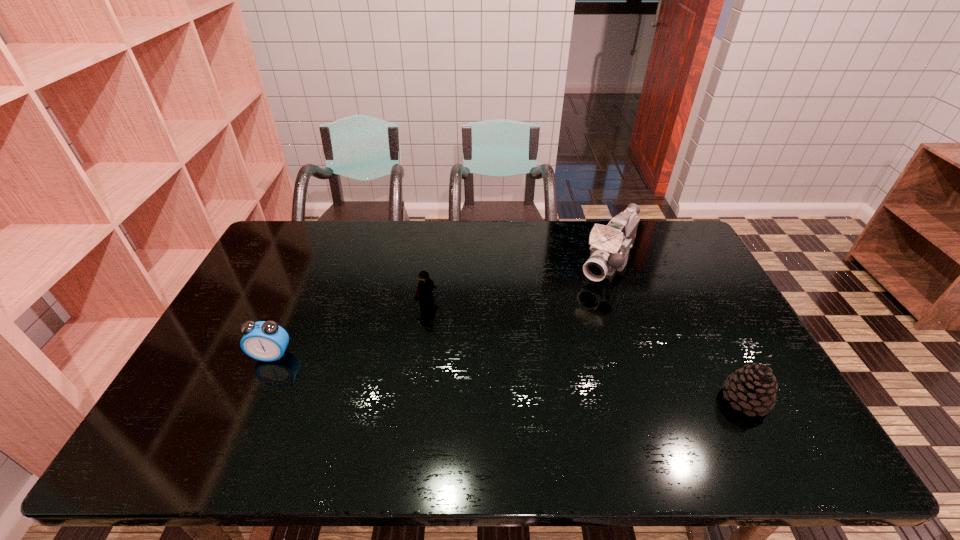
Where is `free space on the desktop that is between the leftmost object and the rightmost object and is positioned on the front-facing side of the third object from left to right`? This screenshot has width=960, height=540. free space on the desktop that is between the leftmost object and the rightmost object and is positioned on the front-facing side of the third object from left to right is located at coordinates (524, 379).

Locate an element on the screen. This screenshot has height=540, width=960. vacant spot on the desktop that is between the leftmost object and the rightmost object and is positioned on the face of the third nearest object is located at coordinates (549, 381).